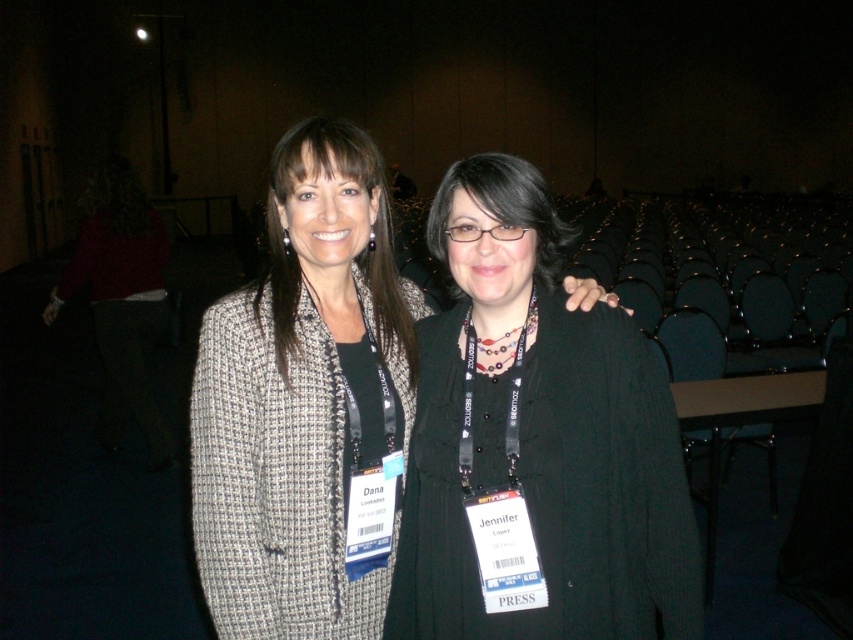
Looking at this image, you are a photographer at an event and need to capture a clear shot of both the matte gray blazer at center and the black matte jacket at center. Which one should you focus on first to ensure it appears sharp in the photo?

You should focus on the black matte jacket at center first because it is closer to the viewer than the matte gray blazer at center, so focusing on the closer object ensures it will be sharp, and the farther one may be slightly out of focus if not adjusted.